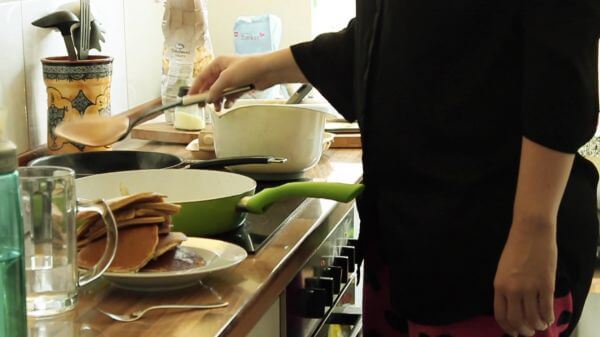
I want to click on bowl, so click(262, 122).